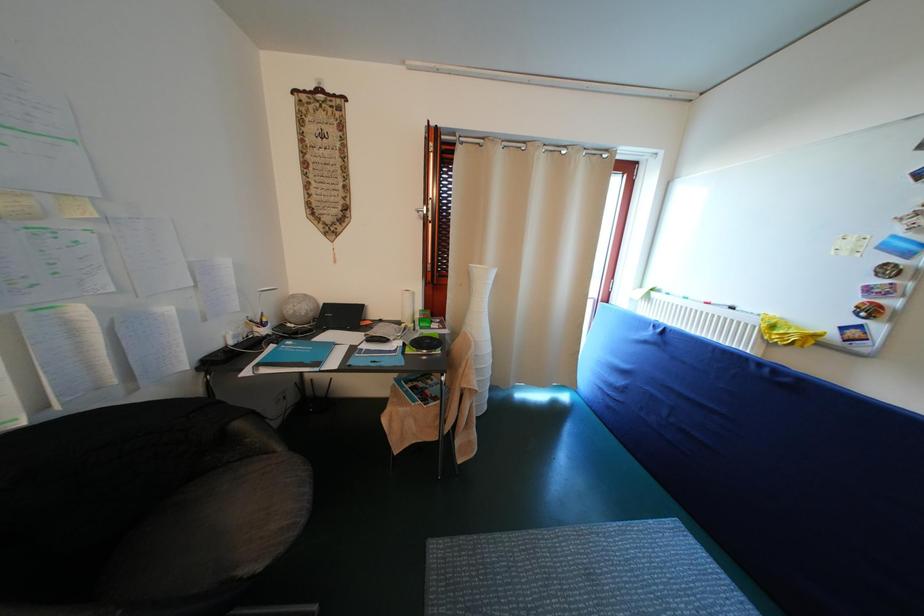
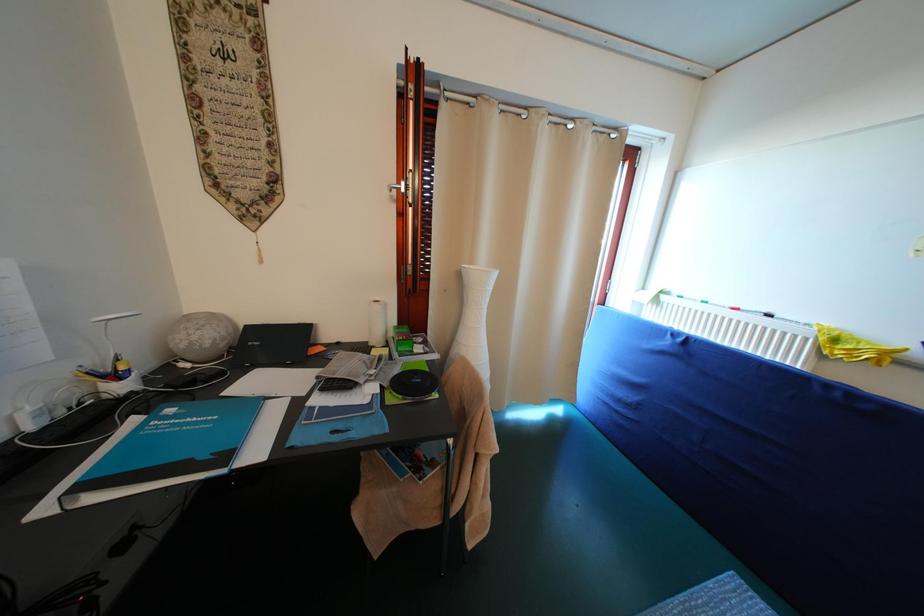
Question: Based on the continuous images, in which direction is the camera rotating? Reply with the corresponding letter.

Choices:
 (A) Left
 (B) Right
 (C) Up
 (D) Down

Answer: (B)